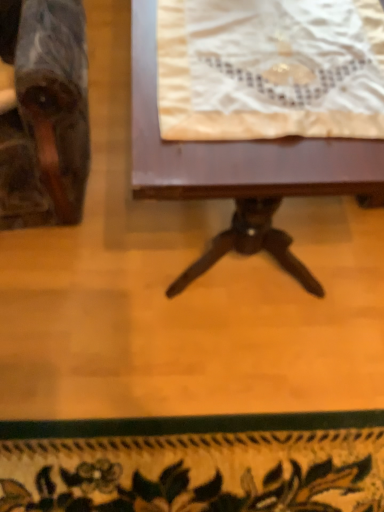
You are a GUI agent. You are given a task and a screenshot of the screen. Output one action in this format:
    pyautogui.click(x=<x>, y=<y>)
    Task: Click on the vacant region below white lace cloth at upper center (from a real-world perspective)
    The width and height of the screenshot is (384, 512).
    Given the screenshot: What is the action you would take?
    pyautogui.click(x=282, y=62)